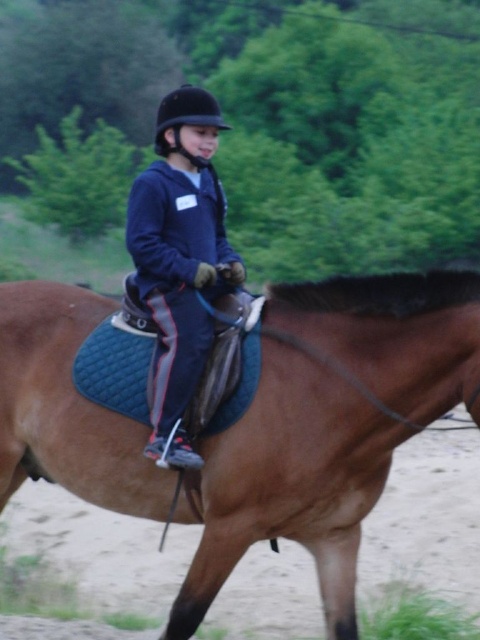
Question: Which object is positioned closest to the brown leather saddle at center?

Choices:
 (A) black matte helmet at center
 (B) dark blue fleece jacket at center

Answer: (B)

Question: Does dark blue fleece jacket at center lie behind black matte helmet at center?

Choices:
 (A) no
 (B) yes

Answer: (A)

Question: Is dark blue fleece jacket at center smaller than black matte helmet at center?

Choices:
 (A) yes
 (B) no

Answer: (B)

Question: Based on their relative distances, which object is farther from the brown leather saddle at center?

Choices:
 (A) dark blue fleece jacket at center
 (B) black matte helmet at center

Answer: (B)

Question: Does brown leather saddle at center appear on the left side of dark blue fleece jacket at center?

Choices:
 (A) yes
 (B) no

Answer: (B)

Question: Among these objects, which one is farthest from the camera?

Choices:
 (A) brown leather saddle at center
 (B) black matte helmet at center
 (C) dark blue fleece jacket at center

Answer: (B)